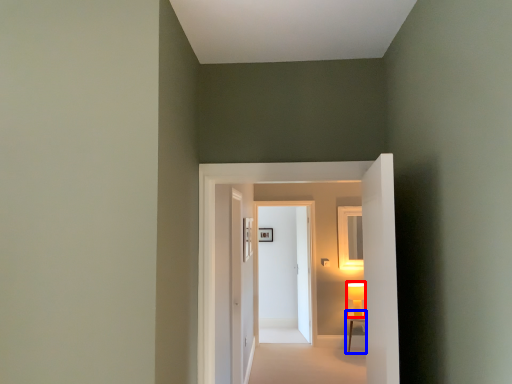
Question: Which point is closer to the camera, table lamp (highlighted by a red box) or table (highlighted by a blue box)?

Choices:
 (A) table lamp
 (B) table

Answer: (B)